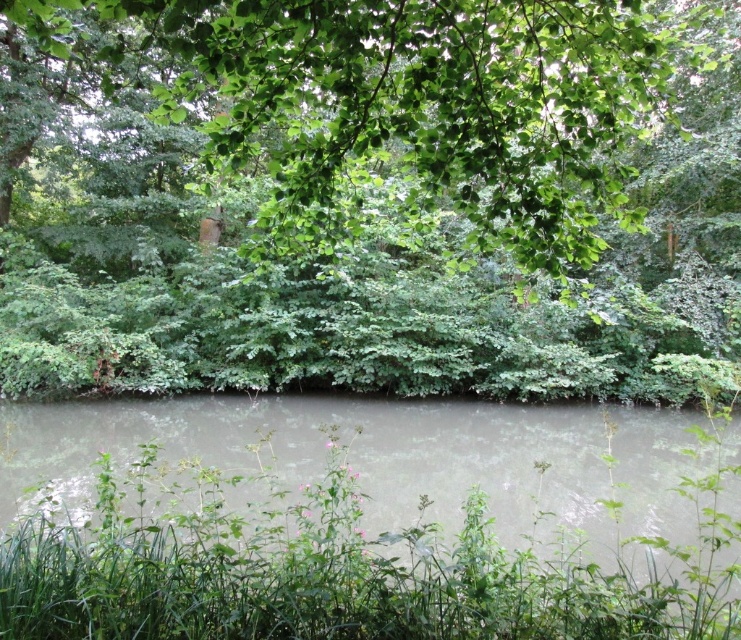
Question: Is the position of green leafy tree at upper center more distant than that of gray murky water at center?

Choices:
 (A) yes
 (B) no

Answer: (B)

Question: Does green leafy tree at upper center lie behind gray murky water at center?

Choices:
 (A) no
 (B) yes

Answer: (A)

Question: Is green leafy tree at upper center in front of gray murky water at center?

Choices:
 (A) no
 (B) yes

Answer: (B)

Question: Among these objects, which one is farthest from the camera?

Choices:
 (A) gray murky water at center
 (B) green leafy tree at upper center

Answer: (A)

Question: Among these objects, which one is nearest to the camera?

Choices:
 (A) green leafy tree at upper center
 (B) gray murky water at center

Answer: (A)